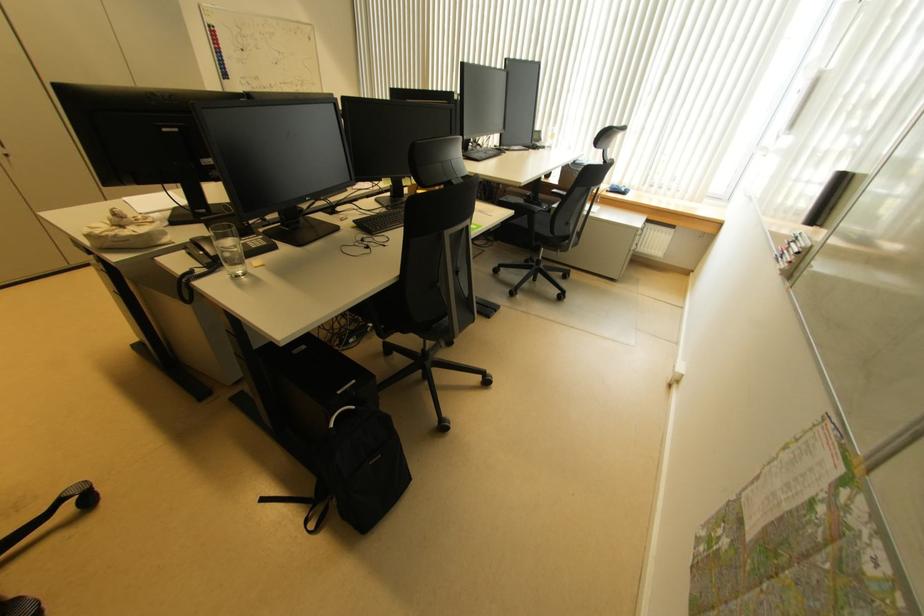
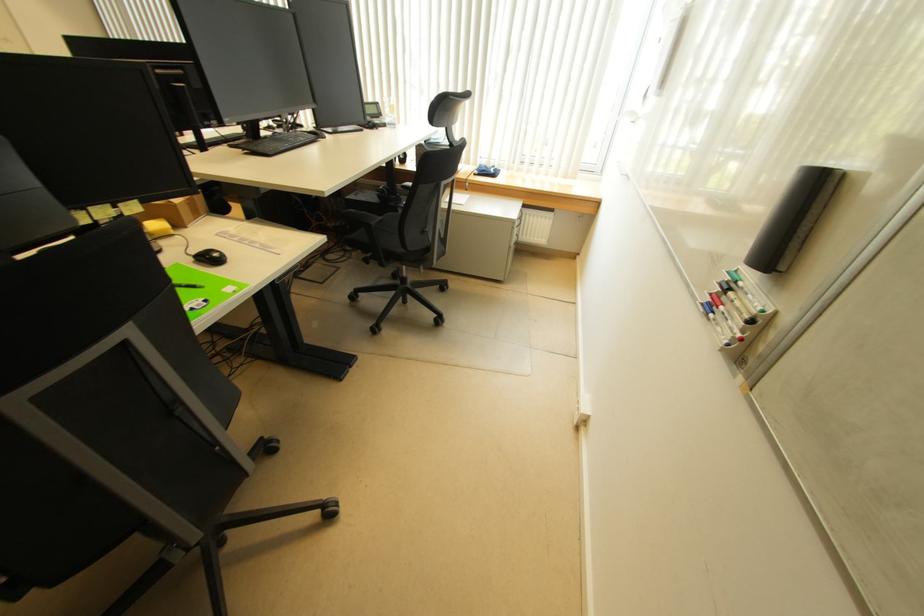
Where in the second image is the point corresponding to [542,143] from the first image?

(382, 118)